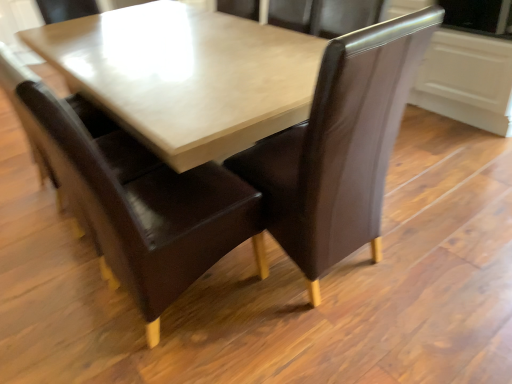
What do you see at coordinates (339, 147) in the screenshot? I see `brown leather chair at center, the 1th chair when ordered from right to left` at bounding box center [339, 147].

You are a GUI agent. You are given a task and a screenshot of the screen. Output one action in this format:
    pyautogui.click(x=<x>, y=<y>)
    Task: Click on the brown leather chair at center, which appears as the second chair when viewed from the left
    This screenshot has height=384, width=512.
    Given the screenshot: What is the action you would take?
    pyautogui.click(x=339, y=147)

Image resolution: width=512 pixels, height=384 pixels. Find the location of `brown leather chair at center, the first chair in the left-to-right sequence`. brown leather chair at center, the first chair in the left-to-right sequence is located at coordinates (135, 197).

Describe the element at coordinates (135, 197) in the screenshot. Image resolution: width=512 pixels, height=384 pixels. I see `brown leather chair at center, the first chair in the left-to-right sequence` at that location.

Where is `brown leather chair at center, which appears as the second chair when viewed from the left`? The width and height of the screenshot is (512, 384). brown leather chair at center, which appears as the second chair when viewed from the left is located at coordinates (339, 147).

Between brown leather chair at center, the first chair in the left-to-right sequence, and brown leather chair at center, the 1th chair when ordered from right to left, which one appears on the left side from the viewer's perspective?

From the viewer's perspective, brown leather chair at center, the first chair in the left-to-right sequence, appears more on the left side.

Is brown leather chair at center, the 2th chair in the right-to-left sequence, closer to the viewer compared to brown leather chair at center, which appears as the second chair when viewed from the left?

Yes, it is in front of brown leather chair at center, which appears as the second chair when viewed from the left.

Is point (141, 170) more distant than point (329, 102)?

Yes, it is.

From the image's perspective, is brown leather chair at center, the first chair in the left-to-right sequence, positioned above or below brown leather chair at center, the 1th chair when ordered from right to left?

Based on their image positions, brown leather chair at center, the first chair in the left-to-right sequence, is located beneath brown leather chair at center, the 1th chair when ordered from right to left.

From a real-world perspective, who is located lower, brown leather chair at center, the 2th chair in the right-to-left sequence, or brown leather chair at center, the 1th chair when ordered from right to left?

brown leather chair at center, the 1th chair when ordered from right to left, is physically lower.

Which of these two, brown leather chair at center, the 2th chair in the right-to-left sequence, or brown leather chair at center, the 1th chair when ordered from right to left, is thinner?

brown leather chair at center, the 1th chair when ordered from right to left, is thinner.

In terms of height, does brown leather chair at center, the 2th chair in the right-to-left sequence, look taller or shorter compared to brown leather chair at center, which appears as the second chair when viewed from the left?

Clearly, brown leather chair at center, the 2th chair in the right-to-left sequence, is taller compared to brown leather chair at center, which appears as the second chair when viewed from the left.

Who is bigger, brown leather chair at center, the first chair in the left-to-right sequence, or brown leather chair at center, the 1th chair when ordered from right to left?

Bigger between the two is brown leather chair at center, the first chair in the left-to-right sequence.

Do you think brown leather chair at center, the first chair in the left-to-right sequence, is within brown leather chair at center, the 1th chair when ordered from right to left, or outside of it?

brown leather chair at center, the first chair in the left-to-right sequence, is spatially situated outside brown leather chair at center, the 1th chair when ordered from right to left.

Is brown leather chair at center, the 2th chair in the right-to-left sequence, with brown leather chair at center, the 1th chair when ordered from right to left?

No, brown leather chair at center, the 2th chair in the right-to-left sequence, is not in contact with brown leather chair at center, the 1th chair when ordered from right to left.

Does brown leather chair at center, the first chair in the left-to-right sequence, turn towards brown leather chair at center, the 1th chair when ordered from right to left?

Yes, brown leather chair at center, the first chair in the left-to-right sequence, is oriented towards brown leather chair at center, the 1th chair when ordered from right to left.

Consider the image. Can you tell me how much brown leather chair at center, the first chair in the left-to-right sequence, and brown leather chair at center, which appears as the second chair when viewed from the left, differ in facing direction?

There is a 89.5-degree angle between the facing directions of brown leather chair at center, the first chair in the left-to-right sequence, and brown leather chair at center, which appears as the second chair when viewed from the left.

The width and height of the screenshot is (512, 384). I want to click on chair located above the brown leather chair at center, which appears as the second chair when viewed from the left (from a real-world perspective), so click(135, 197).

Considering the positions of objects brown leather chair at center, the 1th chair when ordered from right to left, and brown leather chair at center, the 2th chair in the right-to-left sequence, in the image provided, who is more to the left, brown leather chair at center, the 1th chair when ordered from right to left, or brown leather chair at center, the 2th chair in the right-to-left sequence,?

brown leather chair at center, the 2th chair in the right-to-left sequence.

Based on the photo, considering the positions of objects brown leather chair at center, which appears as the second chair when viewed from the left, and brown leather chair at center, the 2th chair in the right-to-left sequence, in the image provided, who is in front, brown leather chair at center, which appears as the second chair when viewed from the left, or brown leather chair at center, the 2th chair in the right-to-left sequence,?

brown leather chair at center, the 2th chair in the right-to-left sequence, is in front.

Considering the points (337, 86) and (116, 236), which point is in front, point (337, 86) or point (116, 236)?

The point (337, 86) is more forward.

From the image's perspective, which is above, brown leather chair at center, which appears as the second chair when viewed from the left, or brown leather chair at center, the first chair in the left-to-right sequence?

brown leather chair at center, which appears as the second chair when viewed from the left, appears higher in the image.

From a real-world perspective, which is physically below, brown leather chair at center, the 1th chair when ordered from right to left, or brown leather chair at center, the first chair in the left-to-right sequence?

brown leather chair at center, the 1th chair when ordered from right to left.

Is brown leather chair at center, the 1th chair when ordered from right to left, wider or thinner than brown leather chair at center, the first chair in the left-to-right sequence?

Clearly, brown leather chair at center, the 1th chair when ordered from right to left, has less width compared to brown leather chair at center, the first chair in the left-to-right sequence.

Between brown leather chair at center, the 1th chair when ordered from right to left, and brown leather chair at center, the 2th chair in the right-to-left sequence, which one has more height?

brown leather chair at center, the 2th chair in the right-to-left sequence, is taller.

Considering the sizes of objects brown leather chair at center, which appears as the second chair when viewed from the left, and brown leather chair at center, the 2th chair in the right-to-left sequence, in the image provided, who is smaller, brown leather chair at center, which appears as the second chair when viewed from the left, or brown leather chair at center, the 2th chair in the right-to-left sequence,?

brown leather chair at center, which appears as the second chair when viewed from the left.

From the picture: Is brown leather chair at center, the 1th chair when ordered from right to left, situated inside brown leather chair at center, the first chair in the left-to-right sequence, or outside?

brown leather chair at center, the 1th chair when ordered from right to left, is spatially situated outside brown leather chair at center, the first chair in the left-to-right sequence.

Are brown leather chair at center, the 1th chair when ordered from right to left, and brown leather chair at center, the first chair in the left-to-right sequence, making contact?

No, brown leather chair at center, the 1th chair when ordered from right to left, is not beside brown leather chair at center, the first chair in the left-to-right sequence.

Is brown leather chair at center, which appears as the second chair when viewed from the left, aimed at brown leather chair at center, the 2th chair in the right-to-left sequence?

No.

How far apart are brown leather chair at center, which appears as the second chair when viewed from the left, and brown leather chair at center, the first chair in the left-to-right sequence?

brown leather chair at center, which appears as the second chair when viewed from the left, and brown leather chair at center, the first chair in the left-to-right sequence, are 15.89 inches apart from each other.

Where is `chair located on the right of brown leather chair at center, the first chair in the left-to-right sequence`? The image size is (512, 384). chair located on the right of brown leather chair at center, the first chair in the left-to-right sequence is located at coordinates (339, 147).

The image size is (512, 384). Find the location of `chair on the right of brown leather chair at center, the 2th chair in the right-to-left sequence`. chair on the right of brown leather chair at center, the 2th chair in the right-to-left sequence is located at coordinates (339, 147).

Locate an element on the screen. This screenshot has height=384, width=512. chair lying below the brown leather chair at center, the 1th chair when ordered from right to left (from the image's perspective) is located at coordinates (135, 197).